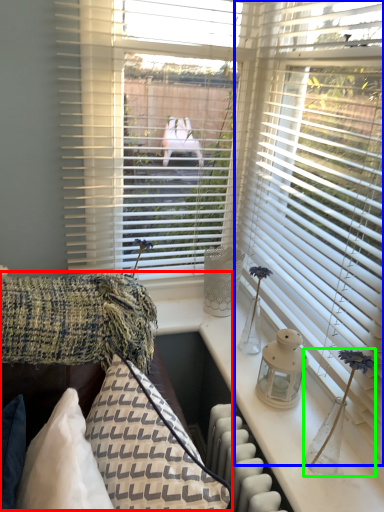
Question: Considering the real-world distances, which object is farthest from couch (highlighted by a red box)? window blind (highlighted by a blue box) or table lamp (highlighted by a green box)?

Choices:
 (A) window blind
 (B) table lamp

Answer: (A)